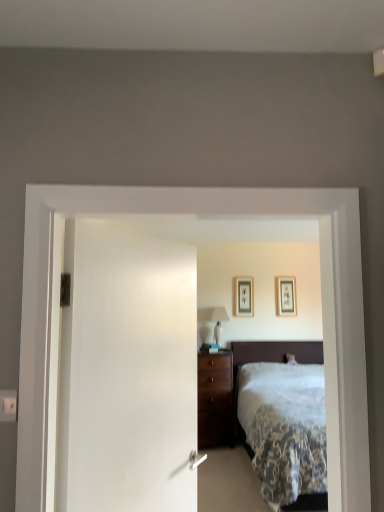
Describe the element at coordinates (244, 296) in the screenshot. I see `matte black picture frame at center, which is the 1th picture frame in left-to-right order` at that location.

Describe the element at coordinates (8, 405) in the screenshot. I see `white plastic electric outlet at lower left` at that location.

Image resolution: width=384 pixels, height=512 pixels. Describe the element at coordinates (218, 321) in the screenshot. I see `white glossy table lamp at center` at that location.

Find the location of `white glossy table lamp at center`. white glossy table lamp at center is located at coordinates (218, 321).

What do you see at coordinates (270, 361) in the screenshot? The width and height of the screenshot is (384, 512). I see `white soft bed at center` at bounding box center [270, 361].

Locate an element on the screen. The height and width of the screenshot is (512, 384). matte black picture frame at center, which is the 1th picture frame in left-to-right order is located at coordinates (244, 296).

Considering the sizes of white plastic electric outlet at lower left and white soft bed at center in the image, is white plastic electric outlet at lower left wider or thinner than white soft bed at center?

In the image, white plastic electric outlet at lower left appears to be more narrow than white soft bed at center.

At what (x,y) coordinates should I click in order to perform the action: click on electric outlet that is in front of the white soft bed at center. Please return your answer as a coordinate pair (x, y). Looking at the image, I should click on (8, 405).

Considering the positions of objects white plastic electric outlet at lower left and white soft bed at center in the image provided, who is more to the right, white plastic electric outlet at lower left or white soft bed at center?

white soft bed at center is more to the right.

Is white soft bed at center inside white plastic electric outlet at lower left?

Definitely not — white soft bed at center is not inside white plastic electric outlet at lower left.

Would you say matte black picture frame at upper center, placed as the second picture frame when sorted from left to right, is to the left or to the right of white glossy table lamp at center in the picture?

matte black picture frame at upper center, placed as the second picture frame when sorted from left to right, is positioned on white glossy table lamp at center's right side.

Is point (292, 300) positioned behind point (210, 318)?

No.

This screenshot has width=384, height=512. What are the coordinates of `table lamp below the matte black picture frame at upper center, placed as the second picture frame when sorted from left to right (from the image's perspective)` in the screenshot? It's located at click(218, 321).

Is matte black picture frame at upper center, which is counted as the 1th picture frame, starting from the right, with white glossy table lamp at center?

No, matte black picture frame at upper center, which is counted as the 1th picture frame, starting from the right, is not beside white glossy table lamp at center.

Is point (15, 398) closer or farther from the camera than point (218, 329)?

Point (15, 398).

From the image's perspective, is white plastic electric outlet at lower left above or below white glossy table lamp at center?

From the image's perspective, white plastic electric outlet at lower left appears above white glossy table lamp at center.

Is white plastic electric outlet at lower left at the right side of white glossy table lamp at center?

No, white plastic electric outlet at lower left is not to the right of white glossy table lamp at center.

Can you confirm if white plastic electric outlet at lower left is taller than white glossy table lamp at center?

No, white plastic electric outlet at lower left is not taller than white glossy table lamp at center.

Does matte black picture frame at center, which is the 1th picture frame in left-to-right order, lie behind white plastic electric outlet at lower left?

Yes, it is behind white plastic electric outlet at lower left.

From the image's perspective, relative to white plastic electric outlet at lower left, is matte black picture frame at center, which is the 1th picture frame in left-to-right order, above or below?

Clearly, from the image's perspective, matte black picture frame at center, which is the 1th picture frame in left-to-right order, is below white plastic electric outlet at lower left.

Between matte black picture frame at center, which is the 1th picture frame in left-to-right order, and white plastic electric outlet at lower left, which one has smaller size?

Smaller between the two is white plastic electric outlet at lower left.

Is matte black picture frame at center, which is the 1th picture frame in left-to-right order, to the right of white plastic electric outlet at lower left from the viewer's perspective?

Yes, matte black picture frame at center, which is the 1th picture frame in left-to-right order, is to the right of white plastic electric outlet at lower left.

The image size is (384, 512). Find the location of `table lamp that appears below the white plastic electric outlet at lower left (from a real-world perspective)`. table lamp that appears below the white plastic electric outlet at lower left (from a real-world perspective) is located at coordinates 218,321.

From the image's perspective, who appears lower, white glossy table lamp at center or white plastic electric outlet at lower left?

white glossy table lamp at center, from the image's perspective.

Which is correct: white glossy table lamp at center is inside white plastic electric outlet at lower left, or outside of it?

The correct answer is: outside.

Based on the photo, does white glossy table lamp at center lie behind white plastic electric outlet at lower left?

Yes, the depth of white glossy table lamp at center is greater than that of white plastic electric outlet at lower left.

Considering the relative sizes of white plastic electric outlet at lower left and matte black picture frame at upper center, placed as the second picture frame when sorted from left to right, in the image provided, is white plastic electric outlet at lower left taller than matte black picture frame at upper center, placed as the second picture frame when sorted from left to right,?

Incorrect, the height of white plastic electric outlet at lower left is not larger of that of matte black picture frame at upper center, placed as the second picture frame when sorted from left to right.

From the image's perspective, is white plastic electric outlet at lower left positioned above or below matte black picture frame at upper center, placed as the second picture frame when sorted from left to right?

Based on their image positions, white plastic electric outlet at lower left is located above matte black picture frame at upper center, placed as the second picture frame when sorted from left to right.

Does white plastic electric outlet at lower left appear on the right side of matte black picture frame at upper center, which is counted as the 1th picture frame, starting from the right?

No.

Is white plastic electric outlet at lower left surrounding matte black picture frame at upper center, placed as the second picture frame when sorted from left to right?

That's incorrect, matte black picture frame at upper center, placed as the second picture frame when sorted from left to right, is not inside white plastic electric outlet at lower left.

In terms of size, does white soft bed at center appear bigger or smaller than white plastic electric outlet at lower left?

Clearly, white soft bed at center is larger in size than white plastic electric outlet at lower left.

Does white soft bed at center appear on the right side of white plastic electric outlet at lower left?

Yes.

From their relative heights in the image, would you say white soft bed at center is taller or shorter than white plastic electric outlet at lower left?

Considering their sizes, white soft bed at center has more height than white plastic electric outlet at lower left.

Is white soft bed at center positioned beyond the bounds of white plastic electric outlet at lower left?

Indeed, white soft bed at center is completely outside white plastic electric outlet at lower left.

At what (x,y) coordinates should I click in order to perform the action: click on bed on the right of white plastic electric outlet at lower left. Please return your answer as a coordinate pair (x, y). The width and height of the screenshot is (384, 512). Looking at the image, I should click on (270, 361).

Find the location of a particular element. Image resolution: width=384 pixels, height=512 pixels. table lamp that is in front of the matte black picture frame at upper center, placed as the second picture frame when sorted from left to right is located at coordinates (218, 321).

Estimate the real-world distances between objects in this image. Which object is further from white plastic electric outlet at lower left, white glossy table lamp at center or white soft bed at center?

white glossy table lamp at center.

Based on their spatial positions, is white plastic electric outlet at lower left or white glossy table lamp at center closer to white soft bed at center?

white glossy table lamp at center.

When comparing their distances from white soft bed at center, does matte black picture frame at center, which ranks as the 2th picture frame in right-to-left order, or matte black picture frame at upper center, placed as the second picture frame when sorted from left to right, seem further?

Based on the image, matte black picture frame at center, which ranks as the 2th picture frame in right-to-left order, appears to be further to white soft bed at center.

When comparing their distances from white soft bed at center, does matte black picture frame at upper center, which is counted as the 1th picture frame, starting from the right, or white plastic electric outlet at lower left seem further?

The object further to white soft bed at center is white plastic electric outlet at lower left.

Estimate the real-world distances between objects in this image. Which object is further from matte black picture frame at upper center, placed as the second picture frame when sorted from left to right, white glossy table lamp at center or matte black picture frame at center, which is the 1th picture frame in left-to-right order?

white glossy table lamp at center is positioned further to the anchor matte black picture frame at upper center, placed as the second picture frame when sorted from left to right.

Which object lies further to the anchor point white plastic electric outlet at lower left, matte black picture frame at upper center, which is counted as the 1th picture frame, starting from the right, or white glossy table lamp at center?

Among the two, matte black picture frame at upper center, which is counted as the 1th picture frame, starting from the right, is located further to white plastic electric outlet at lower left.

Based on their spatial positions, is white plastic electric outlet at lower left or white soft bed at center further from matte black picture frame at center, which is the 1th picture frame in left-to-right order?

white plastic electric outlet at lower left is further to matte black picture frame at center, which is the 1th picture frame in left-to-right order.

Considering their positions, is white soft bed at center positioned closer to white glossy table lamp at center than matte black picture frame at upper center, which is counted as the 1th picture frame, starting from the right?

The object closer to white glossy table lamp at center is white soft bed at center.

The height and width of the screenshot is (512, 384). Identify the location of table lamp between white soft bed at center and matte black picture frame at upper center, which is counted as the 1th picture frame, starting from the right, in the front-back direction. (218, 321).

Where is `picture frame between white glossy table lamp at center and matte black picture frame at upper center, which is counted as the 1th picture frame, starting from the right, in the horizontal direction`? The image size is (384, 512). picture frame between white glossy table lamp at center and matte black picture frame at upper center, which is counted as the 1th picture frame, starting from the right, in the horizontal direction is located at coordinates (244, 296).

Identify the location of bed between white plastic electric outlet at lower left and matte black picture frame at upper center, which is counted as the 1th picture frame, starting from the right, from front to back. (270, 361).

Locate an element on the screen. picture frame between white soft bed at center and matte black picture frame at upper center, placed as the second picture frame when sorted from left to right, in the front-back direction is located at coordinates (244, 296).